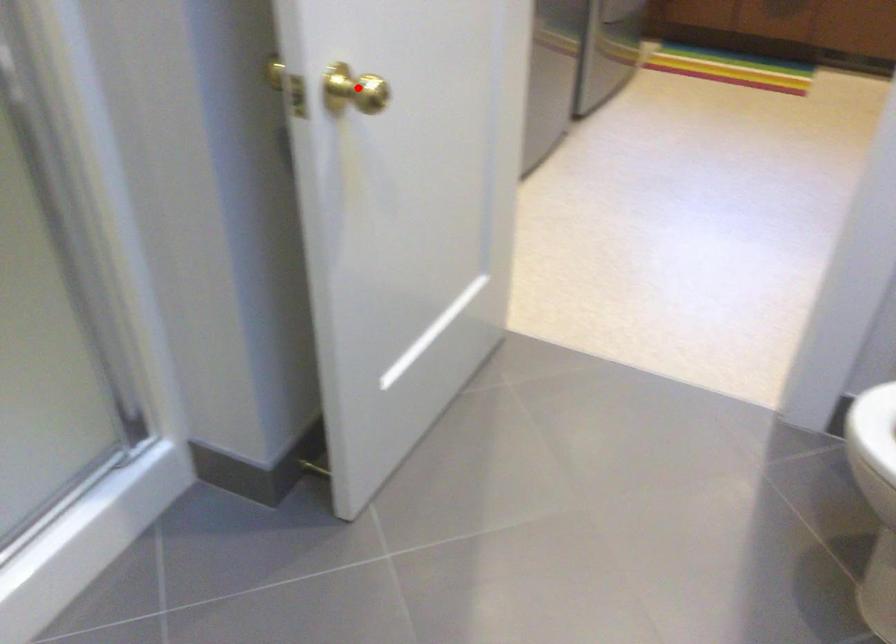
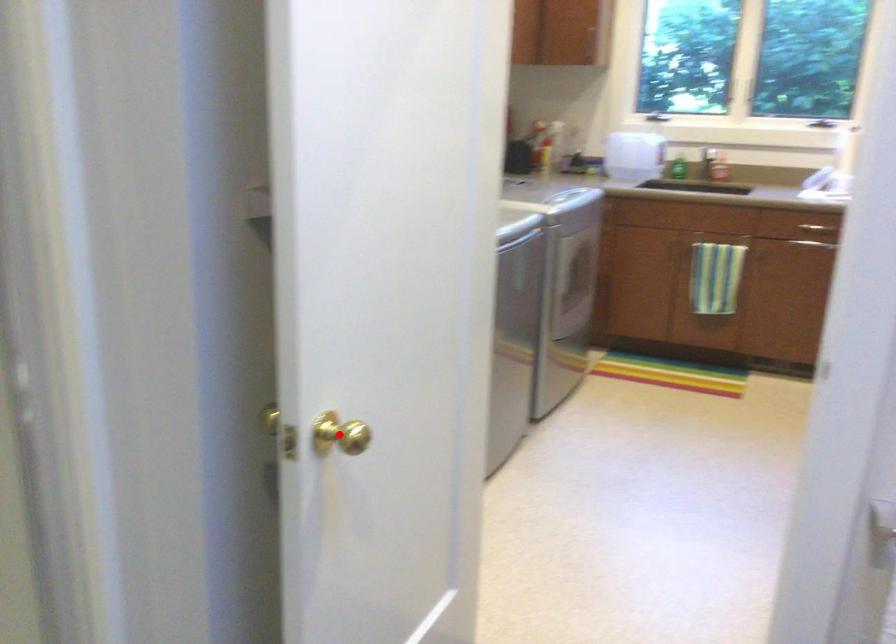
I am providing you with two images of the same scene from different viewpoints. A red point is marked on the first image and another point is marked on the second image. Do the highlighted points in image1 and image2 indicate the same real-world spot?

Yes